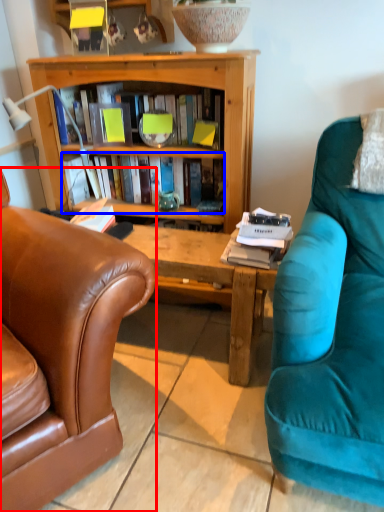
Question: Which point is closer to the camera, chair (highlighted by a red box) or book (highlighted by a blue box)?

Choices:
 (A) chair
 (B) book

Answer: (A)